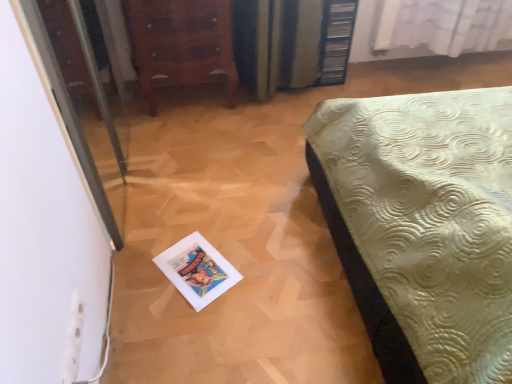
The height and width of the screenshot is (384, 512). In order to click on empty space that is to the right of transparent glass screen door at left in this screenshot , I will do `click(237, 190)`.